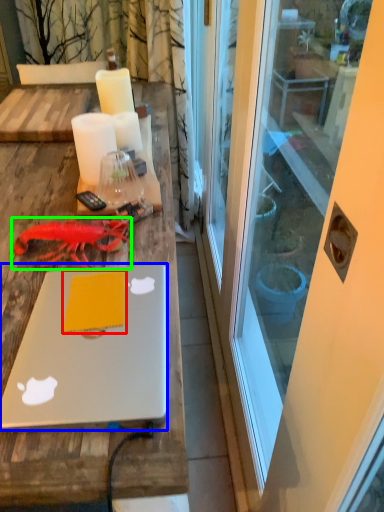
Question: Which is farther away from notepad (highlighted by a red box)? laptop (highlighted by a blue box) or lobster (highlighted by a green box)?

Choices:
 (A) laptop
 (B) lobster

Answer: (B)